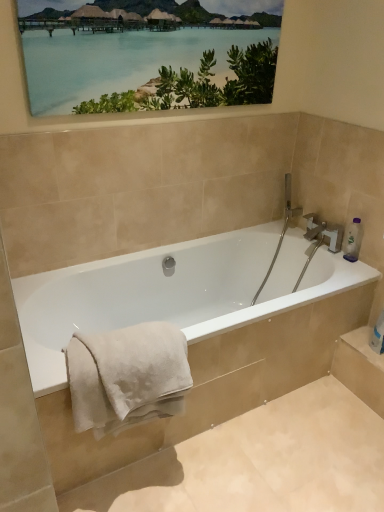
Identify the location of vacant space underneath matte wooden picture frame at upper center (from a real-world perspective). (163, 244).